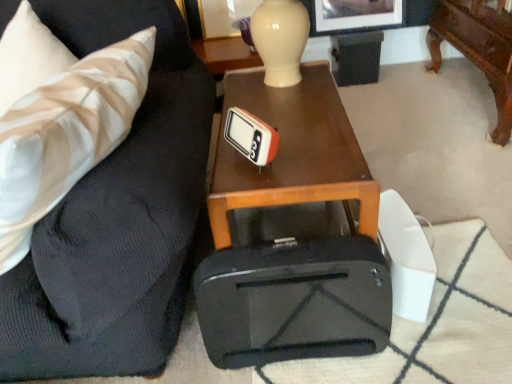
The width and height of the screenshot is (512, 384). I want to click on vacant space to the right of white plastic thermometer at center, so click(315, 155).